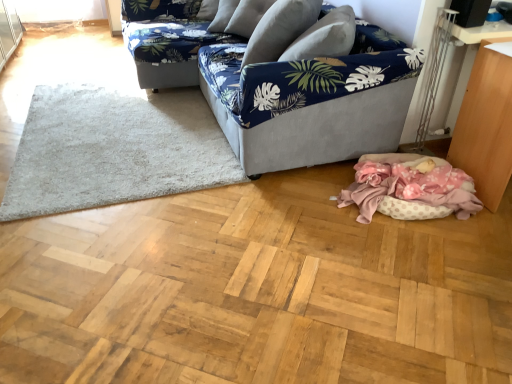
Question: From a real-world perspective, is blue floral fabric couch at upper center, the 1th studio couch viewed from the back, under white shaggy rug at lower left?

Choices:
 (A) yes
 (B) no

Answer: (B)

Question: Is blue floral fabric couch at upper center, arranged as the second studio couch when viewed from the front, thinner than white shaggy rug at lower left?

Choices:
 (A) no
 (B) yes

Answer: (B)

Question: Is blue floral fabric couch at upper center, the 1th studio couch viewed from the back, taller than white shaggy rug at lower left?

Choices:
 (A) no
 (B) yes

Answer: (B)

Question: Considering the relative positions of blue floral fabric couch at upper center, the 1th studio couch viewed from the back, and white shaggy rug at lower left in the image provided, is blue floral fabric couch at upper center, the 1th studio couch viewed from the back, to the right of white shaggy rug at lower left from the viewer's perspective?

Choices:
 (A) no
 (B) yes

Answer: (B)

Question: From the image's perspective, would you say blue floral fabric couch at upper center, the 1th studio couch viewed from the back, is positioned over white shaggy rug at lower left?

Choices:
 (A) yes
 (B) no

Answer: (A)

Question: Is white shaggy rug at lower left inside blue floral fabric couch at upper center, the 1th studio couch viewed from the back?

Choices:
 (A) yes
 (B) no

Answer: (B)

Question: Does navy blue fabric couch at center, marked as the 1th studio couch in a front-to-back arrangement, have a lesser height compared to wooden table at lower right?

Choices:
 (A) no
 (B) yes

Answer: (A)

Question: Is navy blue fabric couch at center, which is the 2th studio couch in back-to-front order, in front of wooden table at lower right?

Choices:
 (A) no
 (B) yes

Answer: (A)

Question: Is navy blue fabric couch at center, marked as the 1th studio couch in a front-to-back arrangement, turned away from wooden table at lower right?

Choices:
 (A) yes
 (B) no

Answer: (B)

Question: Is navy blue fabric couch at center, marked as the 1th studio couch in a front-to-back arrangement, facing towards wooden table at lower right?

Choices:
 (A) yes
 (B) no

Answer: (B)

Question: Would you say navy blue fabric couch at center, which is the 2th studio couch in back-to-front order, is outside wooden table at lower right?

Choices:
 (A) yes
 (B) no

Answer: (A)

Question: Does navy blue fabric couch at center, marked as the 1th studio couch in a front-to-back arrangement, have a lesser width compared to wooden table at lower right?

Choices:
 (A) yes
 (B) no

Answer: (B)

Question: Are wooden table at lower right and blue floral fabric couch at upper center, the 1th studio couch viewed from the back, far apart?

Choices:
 (A) no
 (B) yes

Answer: (B)